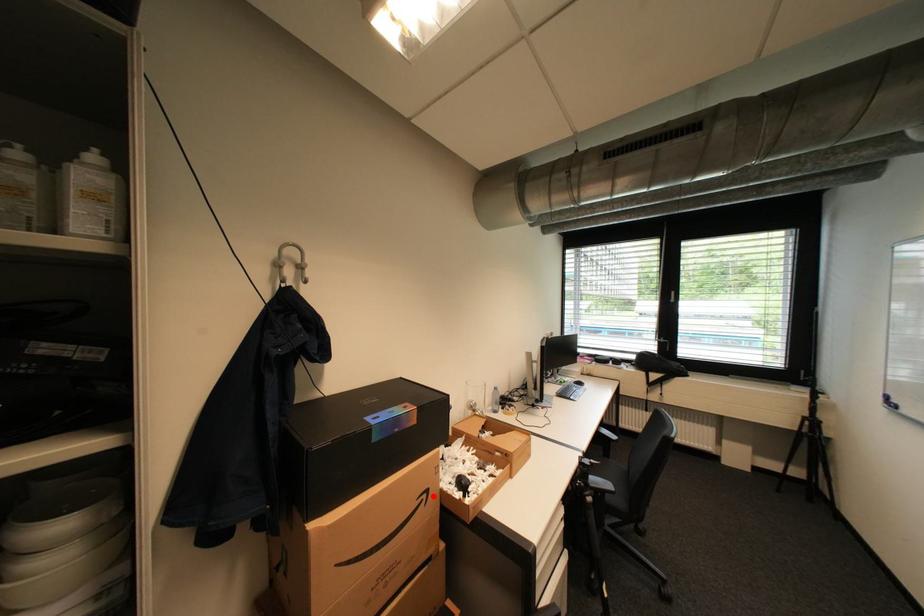
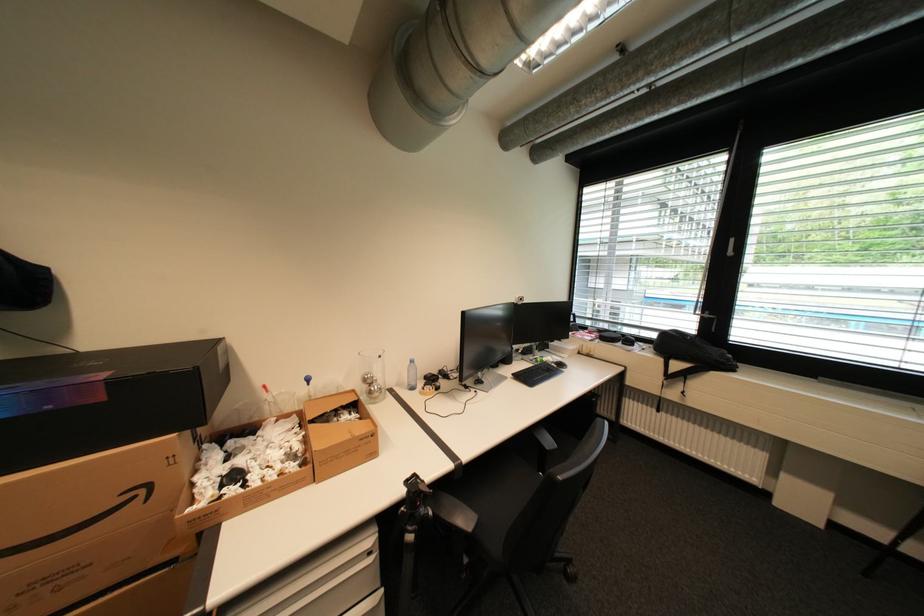
Question: I am providing you with two images of the same scene from different viewpoints. Given a red point in image1, look at the same physical point in image2. Is it:

Choices:
 (A) Closer to the viewpoint
 (B) Farther from the viewpoint

Answer: (A)